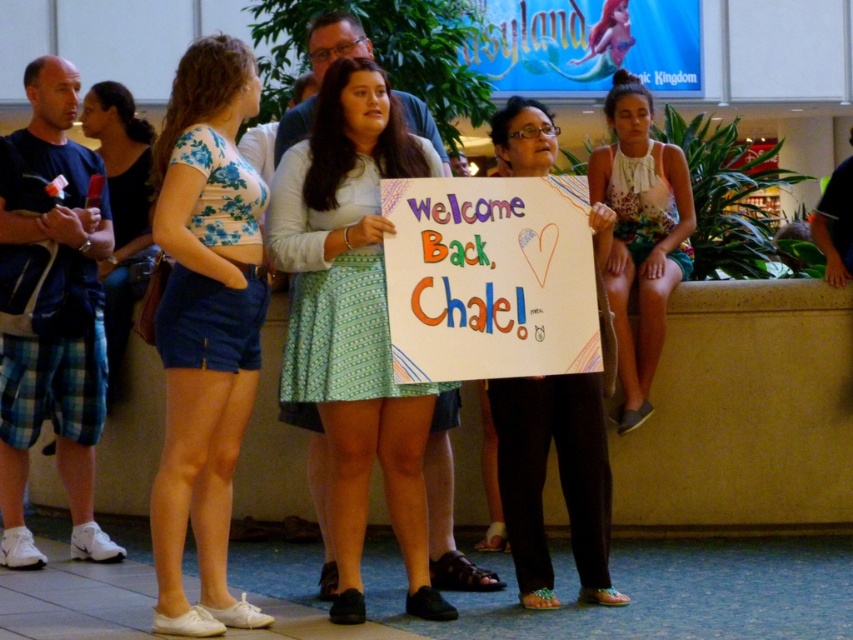
Is green printed skirt at center closer to the viewer compared to blue floral crop top at center?

No, green printed skirt at center is further to the viewer.

Is point (332, 600) positioned behind point (189, 138)?

Yes, point (332, 600) is behind point (189, 138).

Who is more distant from viewer, (x=370, y=157) or (x=207, y=468)?

The point (x=370, y=157) is more distant.

Locate an element on the screen. The image size is (853, 640). green printed skirt at center is located at coordinates (352, 321).

How distant is green printed skirt at center from floral dress at right?

They are 2.49 meters apart.

The width and height of the screenshot is (853, 640). What do you see at coordinates (352, 321) in the screenshot?
I see `green printed skirt at center` at bounding box center [352, 321].

The image size is (853, 640). Describe the element at coordinates (352, 321) in the screenshot. I see `green printed skirt at center` at that location.

The image size is (853, 640). I want to click on green printed skirt at center, so click(352, 321).

Measure the distance between point (495, 310) and camera.

6.47 meters

Can you confirm if handwritten paper sign at center is bigger than denim shorts at left?

Incorrect, handwritten paper sign at center is not larger than denim shorts at left.

This screenshot has height=640, width=853. I want to click on handwritten paper sign at center, so click(x=490, y=278).

The height and width of the screenshot is (640, 853). What are the coordinates of `handwritten paper sign at center` in the screenshot? It's located at (490, 278).